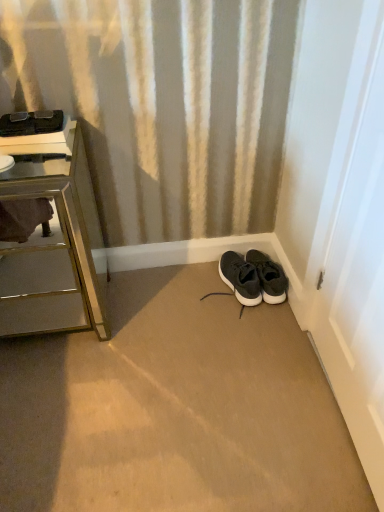
Question: From the image's perspective, is metallic mirrored chest of drawers at left positioned above or below white glossy door at right?

Choices:
 (A) below
 (B) above

Answer: (B)

Question: Does point (29, 168) appear closer or farther from the camera than point (337, 196)?

Choices:
 (A) closer
 (B) farther

Answer: (B)

Question: Which object is the farthest from the black matte sneakers at lower right?

Choices:
 (A) white glossy door at right
 (B) metallic mirrored chest of drawers at left
 (C) matte black sneaker at lower right

Answer: (B)

Question: Estimate the real-world distances between objects in this image. Which object is closer to the black matte sneakers at lower right?

Choices:
 (A) white glossy door at right
 (B) matte black sneaker at lower right
 (C) metallic mirrored chest of drawers at left

Answer: (B)